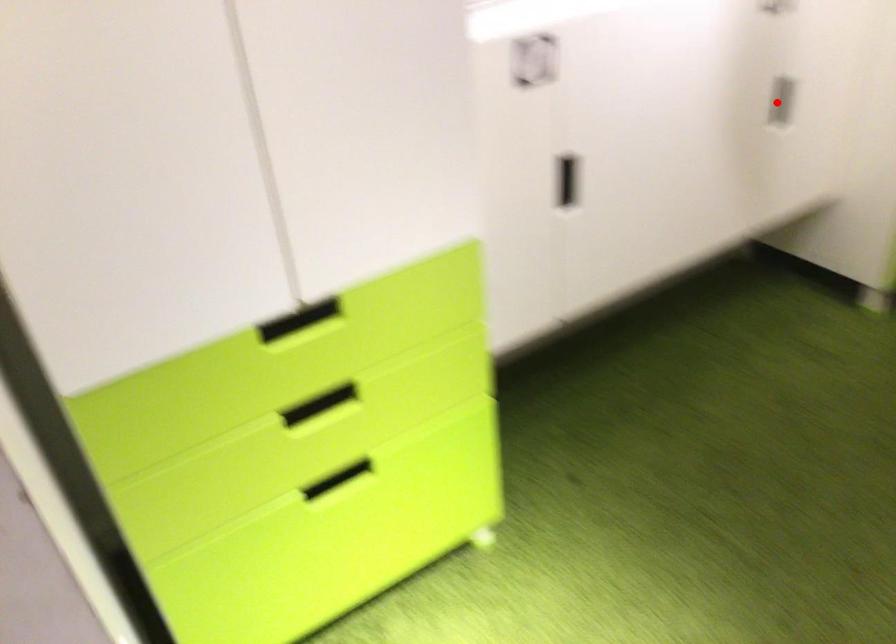
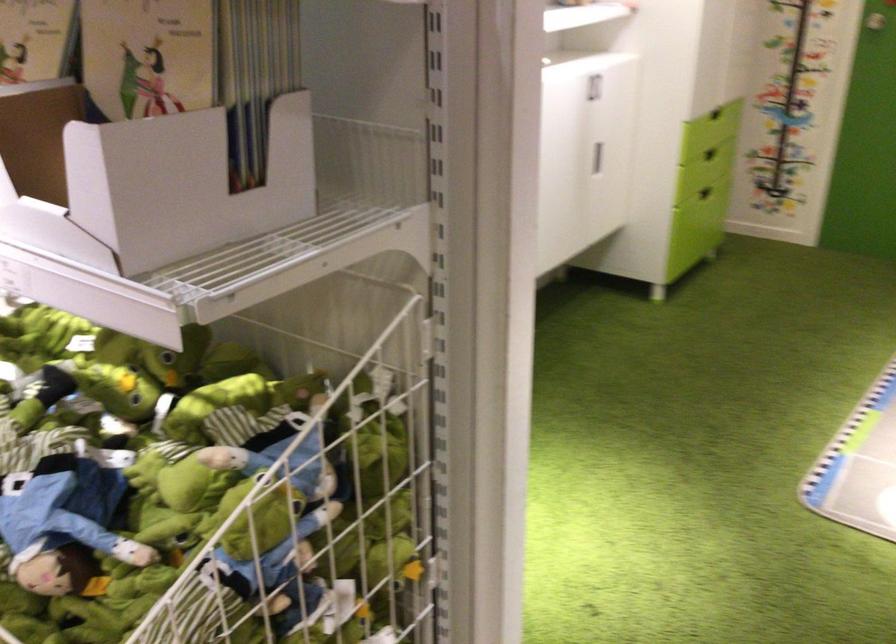
Question: I am providing you with two images of the same scene from different viewpoints. Given a red point in image1, look at the same physical point in image2. Is it:

Choices:
 (A) Closer to the viewpoint
 (B) Farther from the viewpoint

Answer: (B)